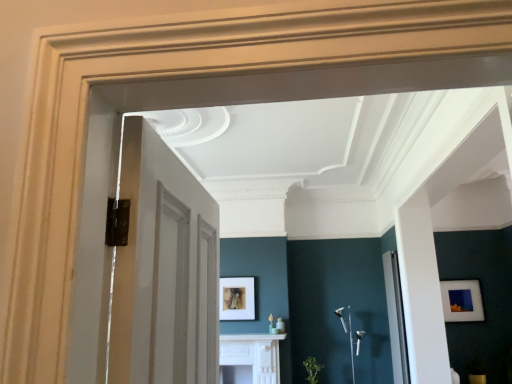
Question: From a real-world perspective, is white glossy fireplace at center located higher than matte white picture frame at right, positioned as the first picture frame in right-to-left order?

Choices:
 (A) yes
 (B) no

Answer: (B)

Question: From the image's perspective, is white glossy fireplace at center on matte white picture frame at right, which is the second picture frame from left to right?

Choices:
 (A) yes
 (B) no

Answer: (B)

Question: Is white glossy fireplace at center thinner than matte white picture frame at right, positioned as the first picture frame in right-to-left order?

Choices:
 (A) no
 (B) yes

Answer: (A)

Question: Does white glossy fireplace at center come behind matte white picture frame at right, which is the second picture frame from left to right?

Choices:
 (A) yes
 (B) no

Answer: (B)

Question: Would you say white glossy fireplace at center is outside matte white picture frame at right, which is the second picture frame from left to right?

Choices:
 (A) no
 (B) yes

Answer: (B)

Question: In terms of height, does green leafy plant at lower center look taller or shorter compared to white glossy fireplace at center?

Choices:
 (A) tall
 (B) short

Answer: (B)

Question: Looking at their shapes, would you say green leafy plant at lower center is wider or thinner than white glossy fireplace at center?

Choices:
 (A) thin
 (B) wide

Answer: (A)

Question: Which is correct: green leafy plant at lower center is inside white glossy fireplace at center, or outside of it?

Choices:
 (A) inside
 (B) outside

Answer: (B)

Question: From a real-world perspective, is green leafy plant at lower center physically located above or below white glossy fireplace at center?

Choices:
 (A) below
 (B) above

Answer: (A)

Question: Considering the positions of point tap(312, 375) and point tap(402, 354), is point tap(312, 375) closer or farther from the camera than point tap(402, 354)?

Choices:
 (A) farther
 (B) closer

Answer: (A)

Question: Relative to clear glass door at right, is green leafy plant at lower center in front or behind?

Choices:
 (A) front
 (B) behind

Answer: (B)

Question: From a real-world perspective, is green leafy plant at lower center above or below clear glass door at right?

Choices:
 (A) above
 (B) below

Answer: (B)

Question: From their relative heights in the image, would you say green leafy plant at lower center is taller or shorter than clear glass door at right?

Choices:
 (A) short
 (B) tall

Answer: (A)

Question: Is matte gold picture frame at center, which ranks as the 2th picture frame in right-to-left order, taller or shorter than green leafy plant at lower center?

Choices:
 (A) short
 (B) tall

Answer: (B)

Question: Relative to green leafy plant at lower center, is matte gold picture frame at center, the first picture frame viewed from the left, in front or behind?

Choices:
 (A) behind
 (B) front

Answer: (A)